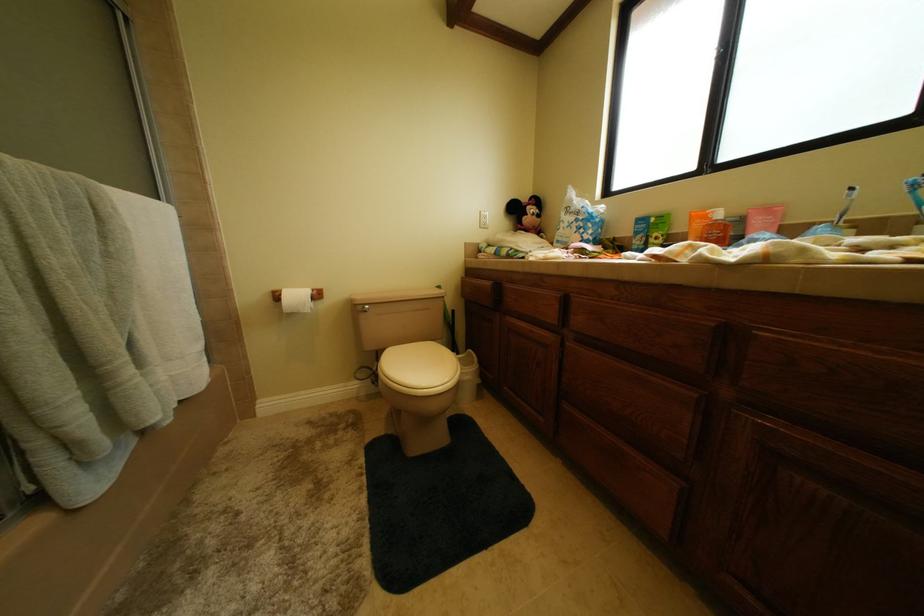
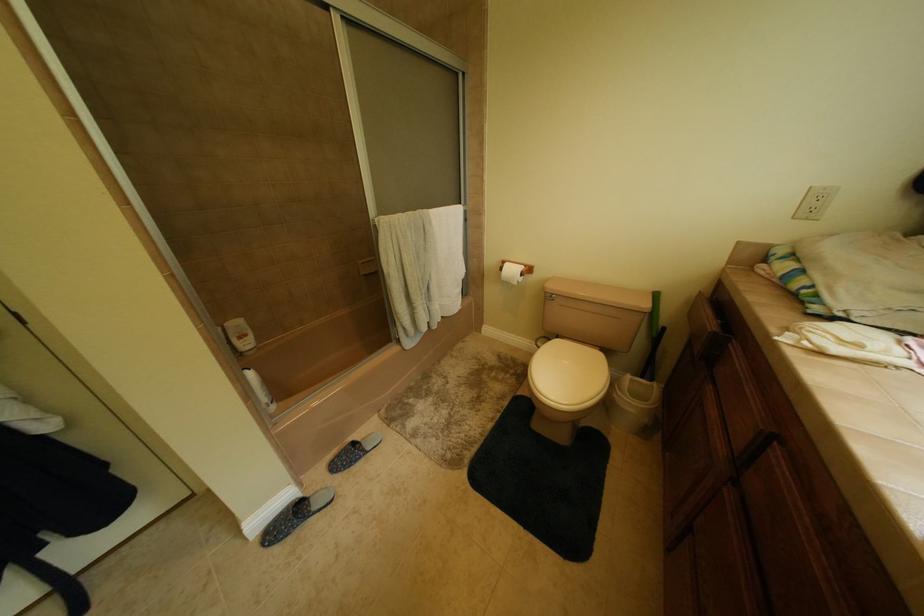
The images are taken continuously from a first-person perspective. In which direction is your viewpoint rotating?

The camera's rotation is toward left-down.